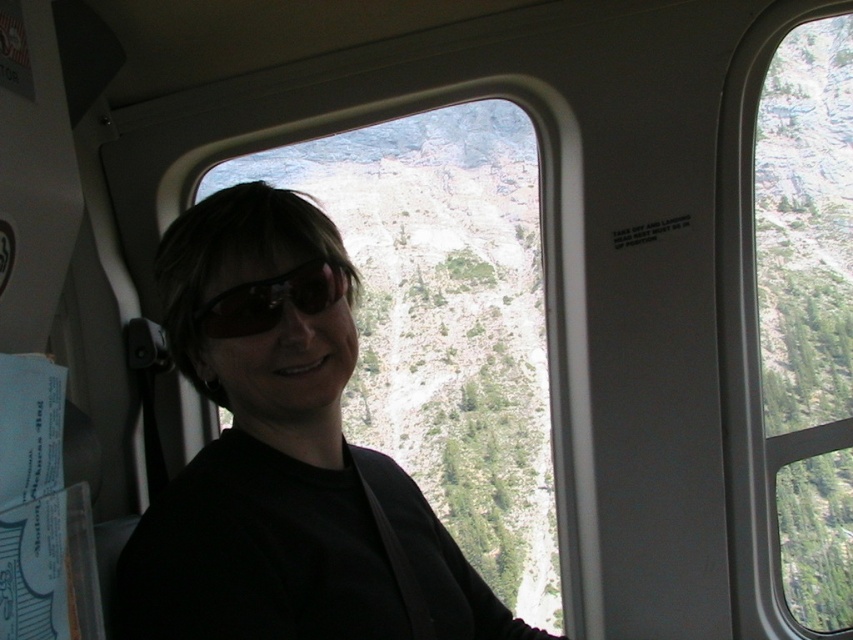
Is matte black shirt at center thinner than black reflective sunglasses at center?

In fact, matte black shirt at center might be wider than black reflective sunglasses at center.

Which is behind, point (225, 211) or point (218, 301)?

The point (225, 211) is more distant.

Identify the location of matte black shirt at center. 283,456.

Is point (288, 212) in front of point (842, 234)?

Yes, point (288, 212) is in front of point (842, 234).

This screenshot has width=853, height=640. Find the location of `matte black shirt at center`. matte black shirt at center is located at coordinates (283, 456).

I want to click on transparent glass window at right, so click(805, 316).

Describe the element at coordinates (805, 316) in the screenshot. I see `transparent glass window at right` at that location.

Where is `transparent glass window at right`? This screenshot has height=640, width=853. transparent glass window at right is located at coordinates (805, 316).